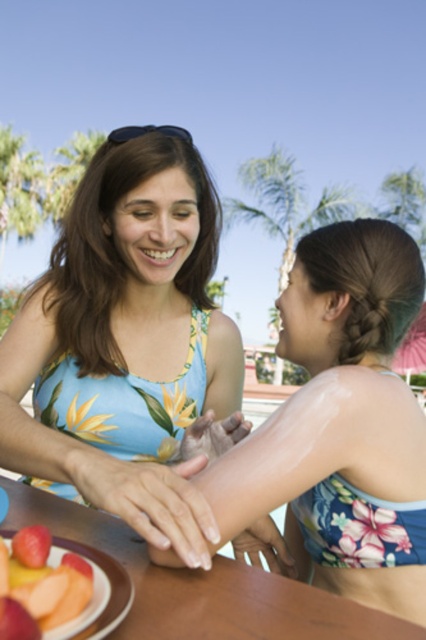
Question: Is blue floral swimsuit at center behind wooden table at center?

Choices:
 (A) no
 (B) yes

Answer: (B)

Question: Can you confirm if floral bikini top at center is positioned to the right of smooth pinkish-orange slices at lower left?

Choices:
 (A) yes
 (B) no

Answer: (A)

Question: Which object is closer to the camera taking this photo?

Choices:
 (A) wooden table at center
 (B) blue floral swimsuit at center
 (C) floral bikini top at center

Answer: (A)

Question: Estimate the real-world distances between objects in this image. Which object is closer to the wooden table at center?

Choices:
 (A) blue floral swimsuit at center
 (B) floral bikini top at center
 (C) smooth pinkish-orange slices at lower left

Answer: (C)

Question: Which object is the farthest from the smooth pinkish-orange slices at lower left?

Choices:
 (A) floral bikini top at center
 (B) blue floral swimsuit at center
 (C) wooden table at center

Answer: (B)

Question: Is blue floral swimsuit at center wider than smooth pinkish-orange slices at lower left?

Choices:
 (A) no
 (B) yes

Answer: (B)